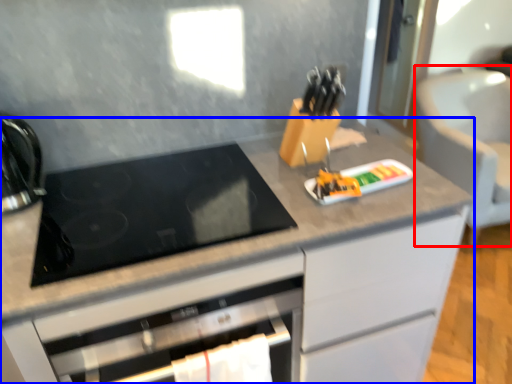
Question: Which object appears farthest to the camera in this image, armchair (highlighted by a red box) or cabinetry (highlighted by a blue box)?

Choices:
 (A) armchair
 (B) cabinetry

Answer: (A)